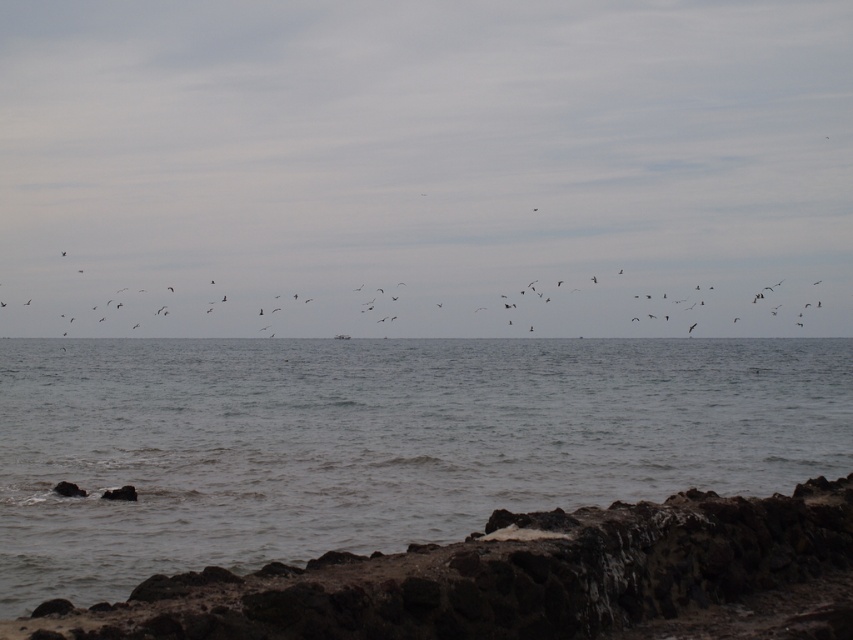
You are a bird flying over the coastal scene. You see the rough volcanic rock at lower right and the dark gray feathers at upper center. Which object is located to the right of the other?

The rough volcanic rock at lower right is positioned on the right side of dark gray feathers at upper center.

You are a bird flying over the coastal scene. You spot the rough volcanic rock at lower right and the dark gray feathers at upper center. How far apart are these two landmarks from each other?

The distance between the rough volcanic rock at lower right and the dark gray feathers at upper center is 1024.77 feet.